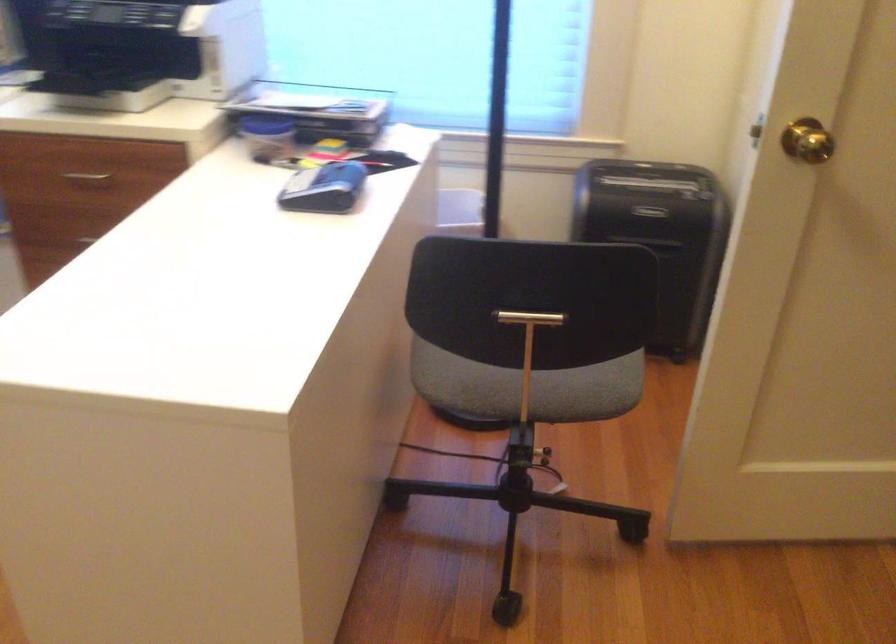
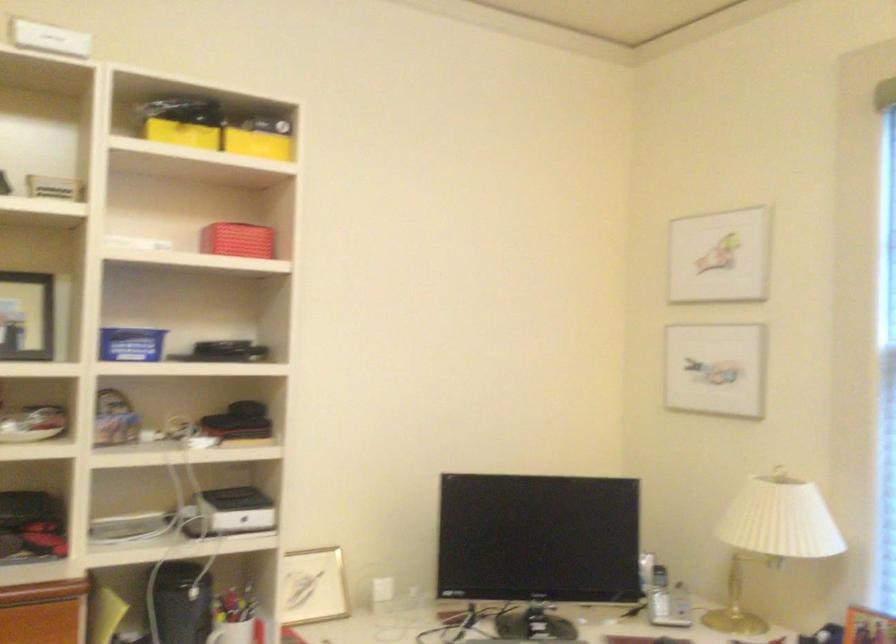
How did the camera likely rotate?

The rotation direction of the camera is left-up.